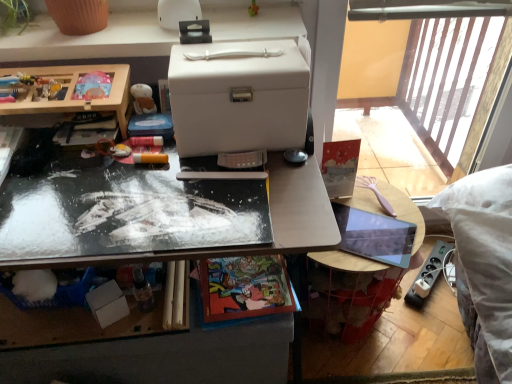
This screenshot has width=512, height=384. I want to click on vacant area on top of wooden toy box at left, the 2th desk positioned from the top (from a real-world perspective), so click(52, 79).